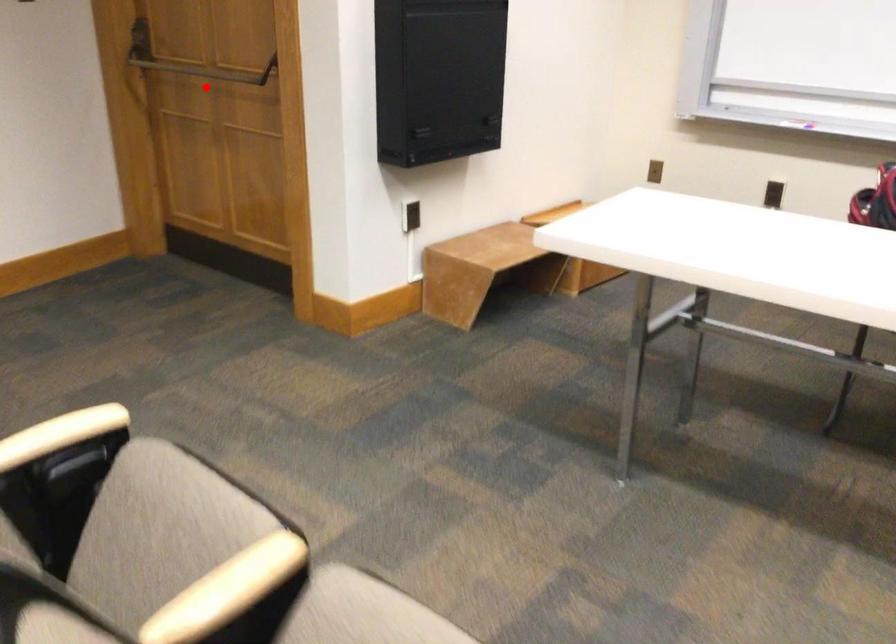
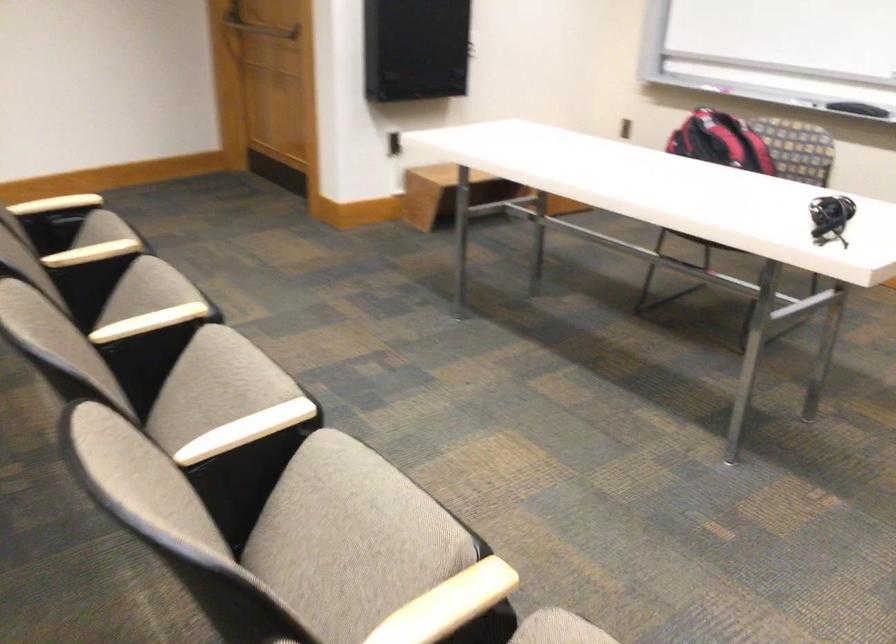
In the second image, find the point that corresponds to the highlighted location in the first image.

(261, 29)